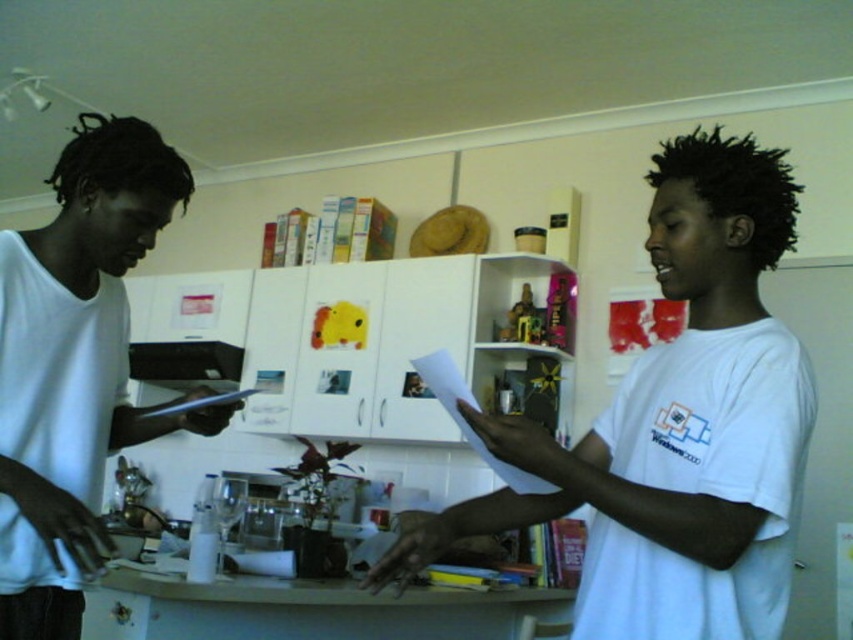
You are a photographer trying to capture a candid shot of the two people in the kitchen. You want to ensure that both the white matte shirt at left and the black hair at center are clearly visible in the frame. Given their relative heights, which object should you focus on first to ensure proper exposure?

The white matte shirt at left is taller than the black hair at center. To ensure proper exposure, focus on the white matte shirt at left first since it is larger in the frame and requires adequate lighting.

You are a painter who needs to paint the black plastic exhaust hood at upper center. However, you don want to get paint on the white matte shirt at left. Based on the scene description, is there a way to paint the exhaust hood without getting paint on the shirt?

The white matte shirt at left is positioned over the black plastic exhaust hood at upper center. Since the shirt is above the exhaust hood, you can paint the hood without worrying about paint dripping onto the shirt.

You are trying to decide whether to hang a new kitchen towel rack that requires 30 cm of space. You see the black hair at center and the black plastic exhaust hood at upper center. Which object has a width that would allow you to determine if there is enough space?

The black plastic exhaust hood at upper center has a width greater than the black hair at center. Since the exhaust hood is wider, if it is at least 30 cm wide, the space would be sufficient. However, without knowing the exact width of the exhaust hood, we cannot confirm if it meets the 30 cm requirement.